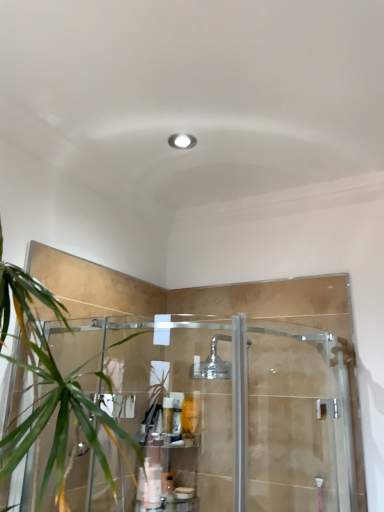
Question: Is the depth of translucent plastic bottle at lower center, positioned as the 1th toiletry in bottom-to-top order, less than that of translucent plastic bottle at center, arranged as the 1th toiletry when viewed from the top?

Choices:
 (A) yes
 (B) no

Answer: (A)

Question: Does translucent plastic bottle at lower center, which ranks as the 3th toiletry in top-to-bottom order, have a lesser height compared to translucent plastic bottle at center, the 3th toiletry in the bottom-to-top sequence?

Choices:
 (A) yes
 (B) no

Answer: (A)

Question: Is translucent plastic bottle at lower center, positioned as the 1th toiletry in bottom-to-top order, positioned with its back to translucent plastic bottle at center, arranged as the 1th toiletry when viewed from the top?

Choices:
 (A) yes
 (B) no

Answer: (B)

Question: Considering the relative sizes of translucent plastic bottle at lower center, positioned as the 1th toiletry in bottom-to-top order, and translucent plastic bottle at center, the 3th toiletry in the bottom-to-top sequence, in the image provided, is translucent plastic bottle at lower center, positioned as the 1th toiletry in bottom-to-top order, thinner than translucent plastic bottle at center, the 3th toiletry in the bottom-to-top sequence,?

Choices:
 (A) yes
 (B) no

Answer: (A)

Question: Can you confirm if translucent plastic bottle at lower center, which ranks as the 3th toiletry in top-to-bottom order, is taller than translucent plastic bottle at center, the 3th toiletry in the bottom-to-top sequence?

Choices:
 (A) no
 (B) yes

Answer: (A)

Question: Considering the relative sizes of translucent plastic bottle at lower center, positioned as the 1th toiletry in bottom-to-top order, and translucent plastic bottle at center, arranged as the 1th toiletry when viewed from the top, in the image provided, is translucent plastic bottle at lower center, positioned as the 1th toiletry in bottom-to-top order, wider than translucent plastic bottle at center, arranged as the 1th toiletry when viewed from the top,?

Choices:
 (A) yes
 (B) no

Answer: (B)

Question: Would you say translucent plastic bottle at lower center, which ranks as the 3th toiletry in top-to-bottom order, contains clear plastic shelf at lower center?

Choices:
 (A) yes
 (B) no

Answer: (B)

Question: Is translucent plastic bottle at lower center, positioned as the 1th toiletry in bottom-to-top order, looking in the opposite direction of clear plastic shelf at lower center?

Choices:
 (A) yes
 (B) no

Answer: (A)

Question: Can you confirm if translucent plastic bottle at lower center, which ranks as the 3th toiletry in top-to-bottom order, is wider than clear plastic shelf at lower center?

Choices:
 (A) no
 (B) yes

Answer: (A)

Question: Could you tell me if translucent plastic bottle at lower center, which ranks as the 3th toiletry in top-to-bottom order, is facing clear plastic shelf at lower center?

Choices:
 (A) yes
 (B) no

Answer: (A)

Question: Is the position of translucent plastic bottle at lower center, which ranks as the 3th toiletry in top-to-bottom order, less distant than that of clear plastic shelf at lower center?

Choices:
 (A) no
 (B) yes

Answer: (A)

Question: Is translucent plastic bottle at lower center, positioned as the 1th toiletry in bottom-to-top order, at the left side of clear plastic shelf at lower center?

Choices:
 (A) yes
 (B) no

Answer: (B)

Question: Is clear plastic shelf at lower center facing away from white matte bottle at lower center, which is the 2th toiletry in top-to-bottom order?

Choices:
 (A) no
 (B) yes

Answer: (B)